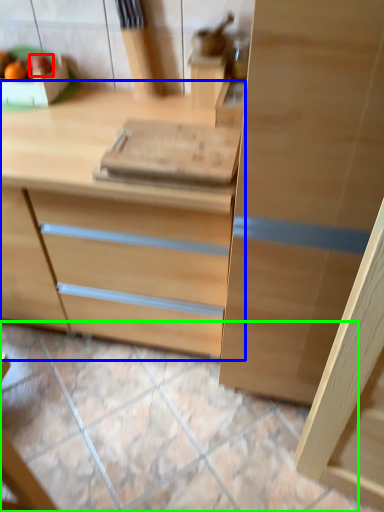
Question: Estimate the real-world distances between objects in this image. Which object is closer to fruit (highlighted by a red box), chest of drawers (highlighted by a blue box) or tile (highlighted by a green box)?

Choices:
 (A) chest of drawers
 (B) tile

Answer: (A)